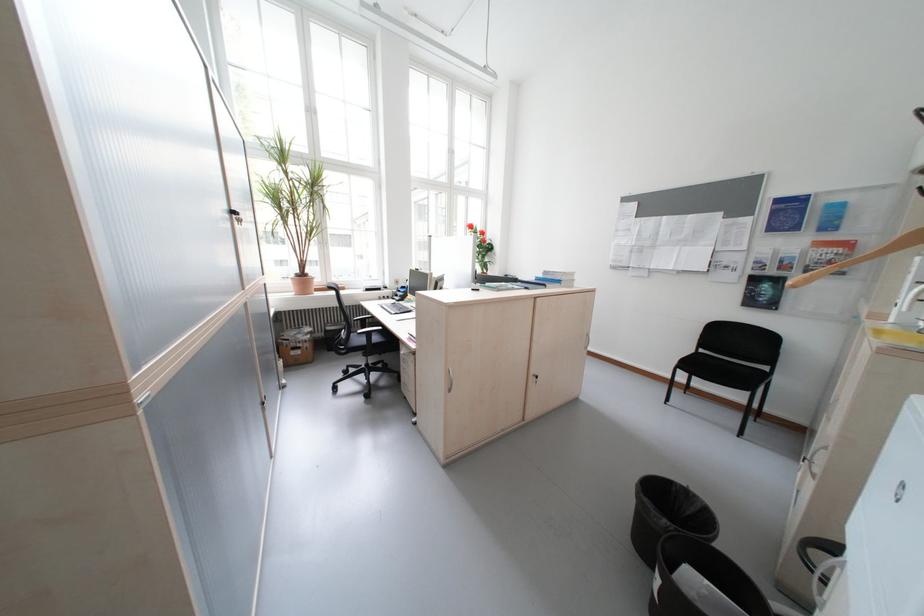
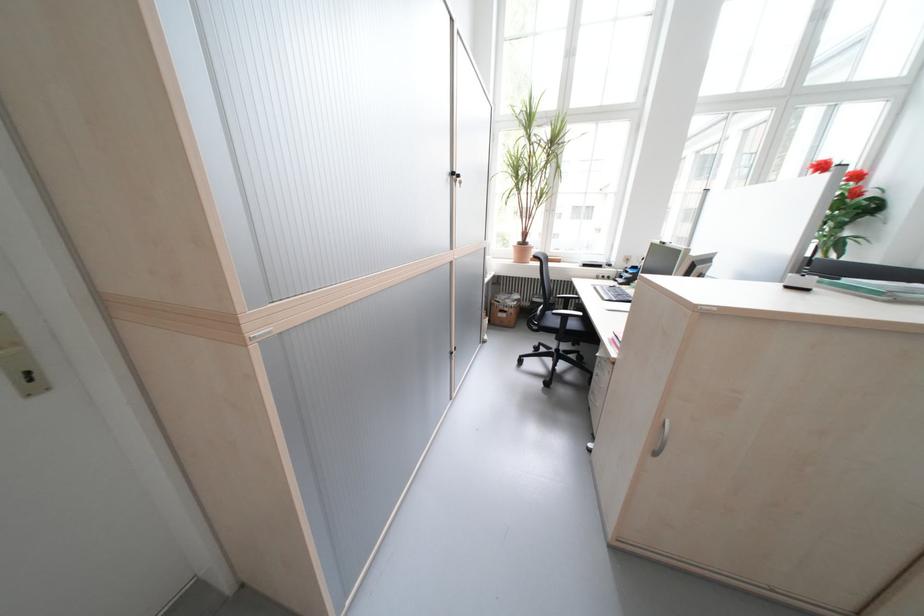
Question: The first image is from the beginning of the video and the second image is from the end. How did the camera likely rotate when shooting the video?

Choices:
 (A) Left
 (B) Right
 (C) Up
 (D) Down

Answer: (A)